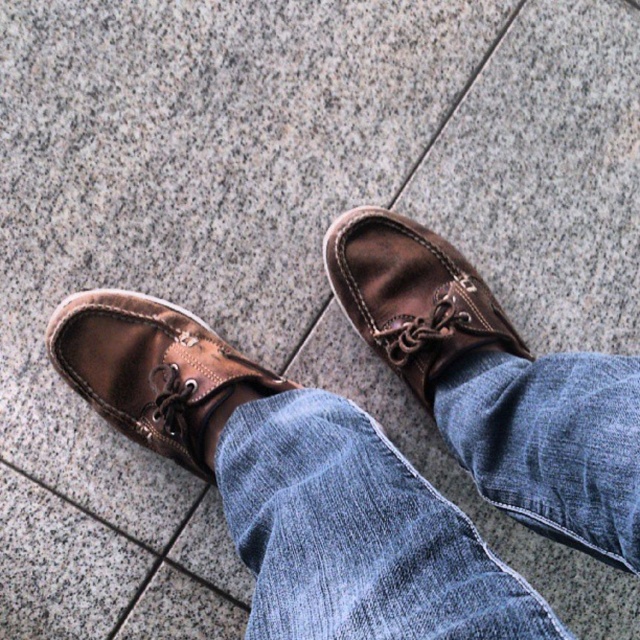
You are a photographer trying to capture the texture of the denim at center and the brown leather shoe at center. Since the lighting is natural daylight, which object would you focus on first to ensure proper exposure?

The denim at center is located below the brown leather shoe at center, so you should focus on the brown leather shoe at center first because it is higher and likely receiving more direct light for better exposure.

You are a tailor observing the denim at center and the leather shoe at center in the image. Which item is positioned higher from the ground?

→ The leather shoe at center is positioned higher from the ground than the denim at center because the denim at center is located below it.